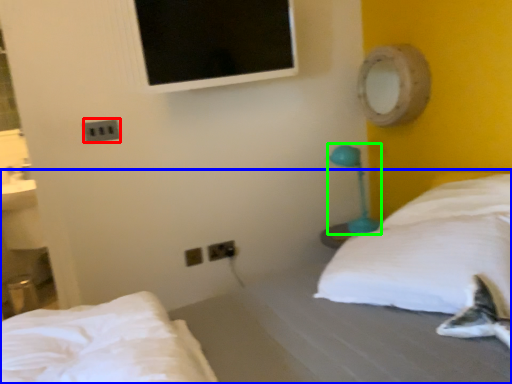
Question: Which is nearer to the electric outlet (highlighted by a red box)? bed (highlighted by a blue box) or table lamp (highlighted by a green box).

Choices:
 (A) bed
 (B) table lamp

Answer: (A)